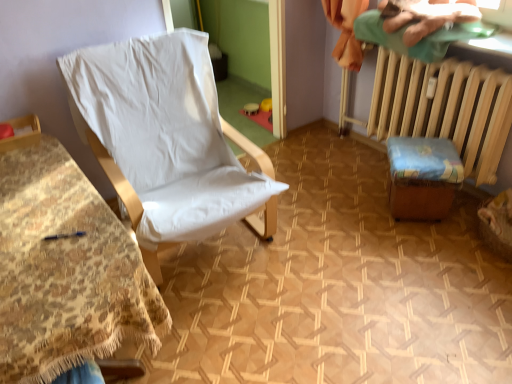
You are a GUI agent. You are given a task and a screenshot of the screen. Output one action in this format:
    pyautogui.click(x=<x>, y=<y>)
    Task: Click on the free space in front of white fabric chair at center
    
    Given the screenshot: What is the action you would take?
    pyautogui.click(x=261, y=329)